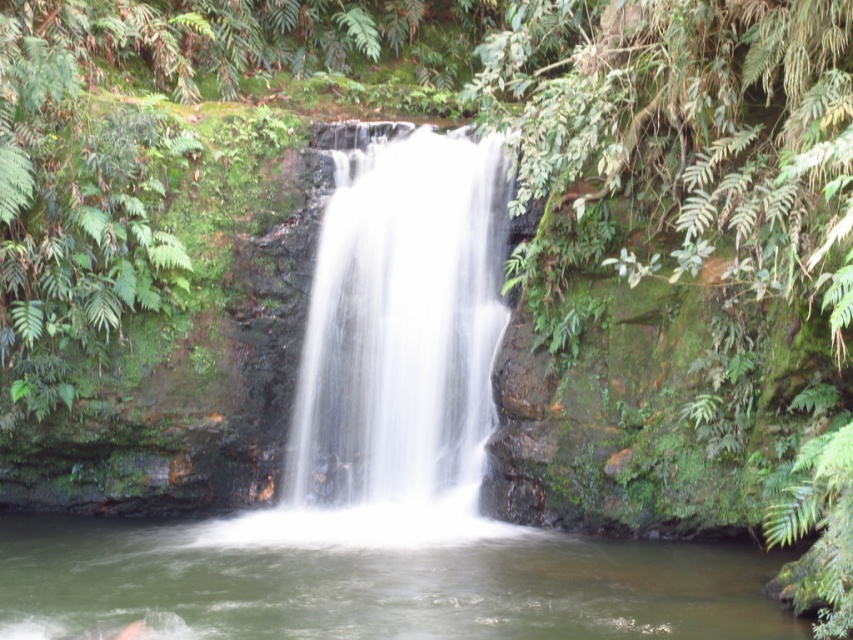
Does greenish water at center have a larger size compared to white smooth waterfall at center?

Yes, greenish water at center is bigger than white smooth waterfall at center.

Between greenish water at center and white smooth waterfall at center, which one has less height?

Standing shorter between the two is greenish water at center.

Does point (701, 557) come closer to viewer compared to point (325, 321)?

Yes, point (701, 557) is closer to viewer.

Where is `greenish water at center`? greenish water at center is located at coordinates (373, 580).